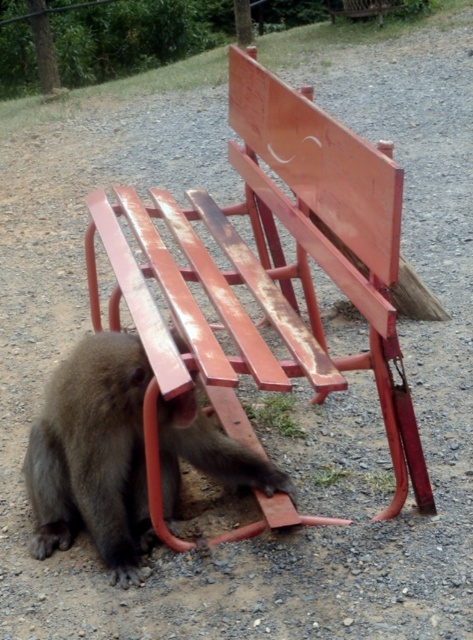
Which of these two, rusty wood bench at lower left or fuzzy brown monkey at lower left, stands shorter?

fuzzy brown monkey at lower left

Can you confirm if rusty wood bench at lower left is taller than fuzzy brown monkey at lower left?

Yes, rusty wood bench at lower left is taller than fuzzy brown monkey at lower left.

Does point (208, 205) lie in front of point (76, 387)?

No, it is not.

In order to click on rusty wood bench at lower left in this screenshot , I will do `click(268, 272)`.